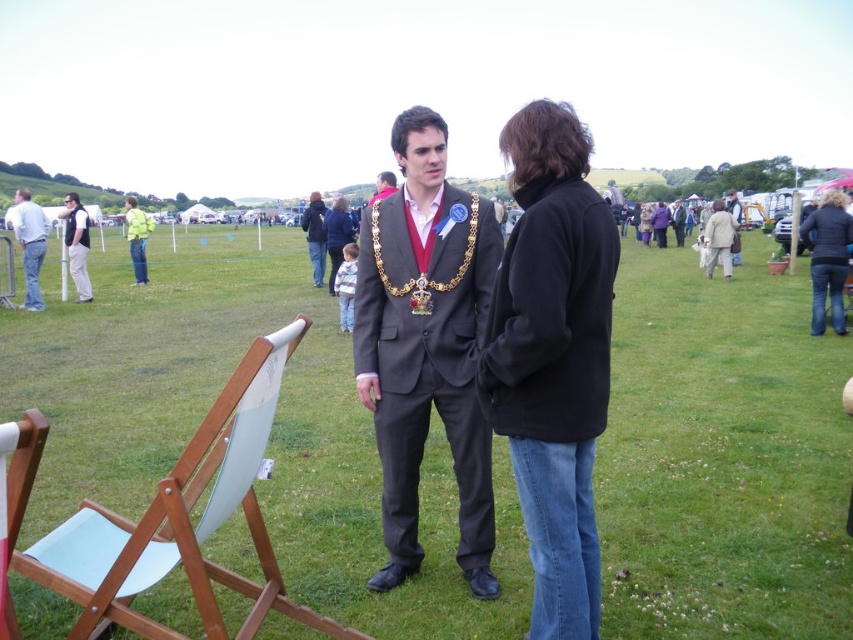
Who is shorter, high visibility jacket at left or matte black suit at center?

Standing shorter between the two is high visibility jacket at left.

Can you confirm if high visibility jacket at left is smaller than matte black suit at center?

Yes, high visibility jacket at left is smaller than matte black suit at center.

Is point (134, 284) closer to viewer compared to point (602, 195)?

Yes, it is in front of point (602, 195).

This screenshot has height=640, width=853. I want to click on high visibility jacket at left, so pyautogui.click(x=137, y=237).

Is point (834, 314) positioned in front of point (619, 220)?

Yes, it is.

Between denim jacket at lower right and matte black suit at center, which one is positioned lower?

Positioned lower is denim jacket at lower right.

Does point (840, 291) come in front of point (608, 179)?

Yes, point (840, 291) is closer to viewer.

What are the coordinates of `denim jacket at lower right` in the screenshot? It's located at (827, 259).

Which is more to the right, wooden chair at lower left or high visibility jacket at left?

wooden chair at lower left

Locate an element on the screen. wooden chair at lower left is located at coordinates (15, 497).